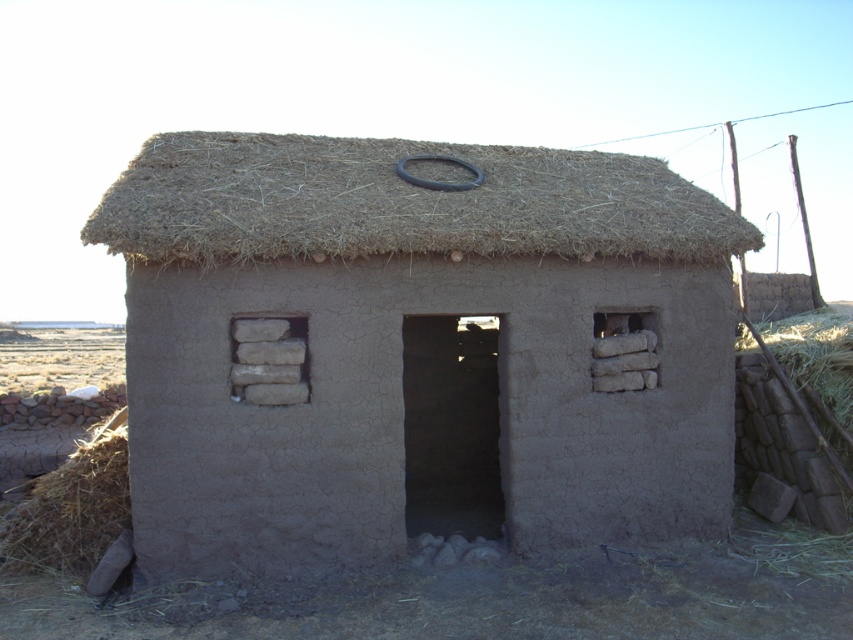
Question: Is brown mud hut at center thinner than brown thatch at center?

Choices:
 (A) no
 (B) yes

Answer: (B)

Question: Is brown mud hut at center wider than brown straw at lower left?

Choices:
 (A) yes
 (B) no

Answer: (B)

Question: Which is farther from the brown straw at lower left?

Choices:
 (A) brown thatch at center
 (B) brown mud hut at center

Answer: (A)

Question: Estimate the real-world distances between objects in this image. Which object is farther from the brown mud hut at center?

Choices:
 (A) brown straw at lower left
 (B) brown thatch at center

Answer: (B)

Question: Which of the following is the farthest from the observer?

Choices:
 (A) (340, 372)
 (B) (469, 252)
 (C) (94, 448)

Answer: (C)

Question: Can you confirm if brown mud hut at center is positioned above brown straw at lower left?

Choices:
 (A) no
 (B) yes

Answer: (B)